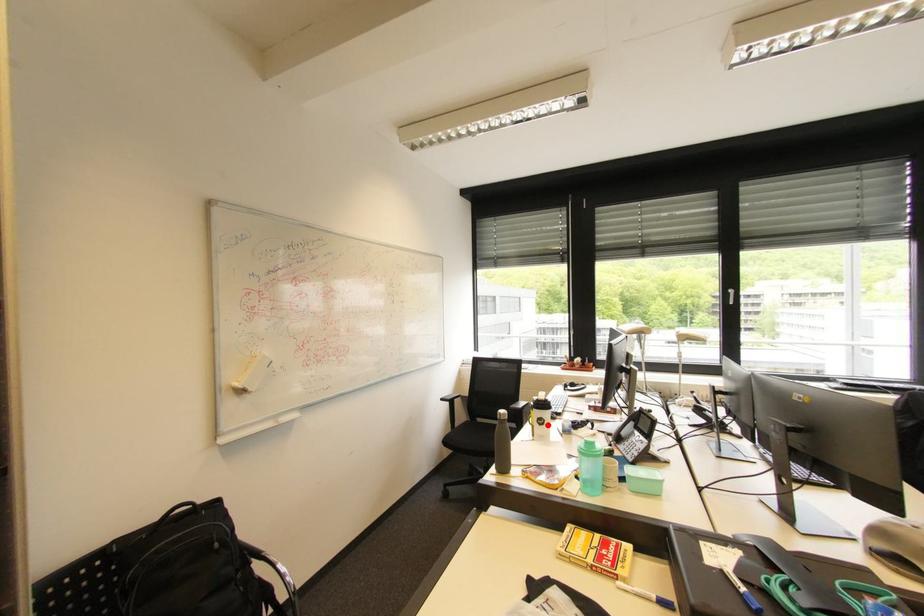
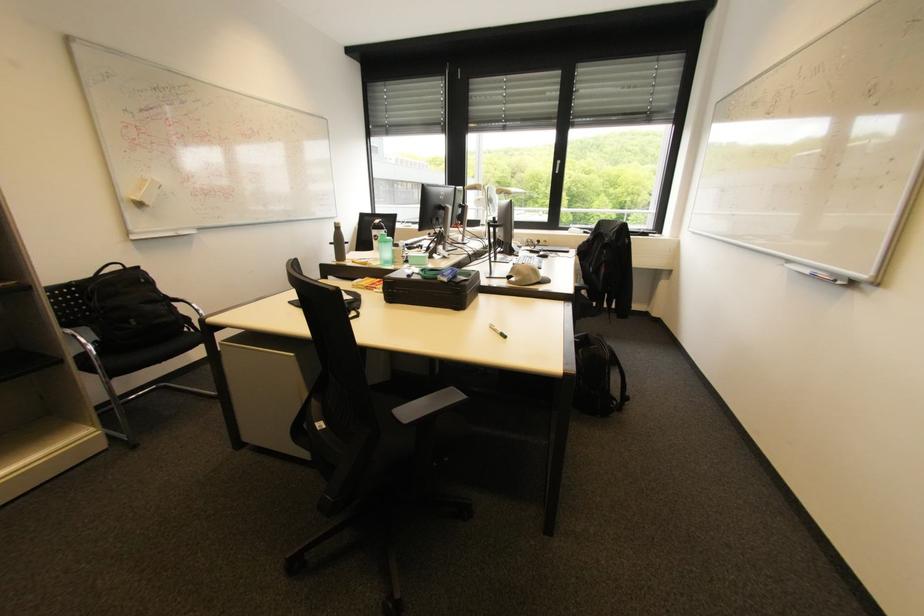
In the second image, find the point that corresponds to the highlighted location in the first image.

(382, 240)